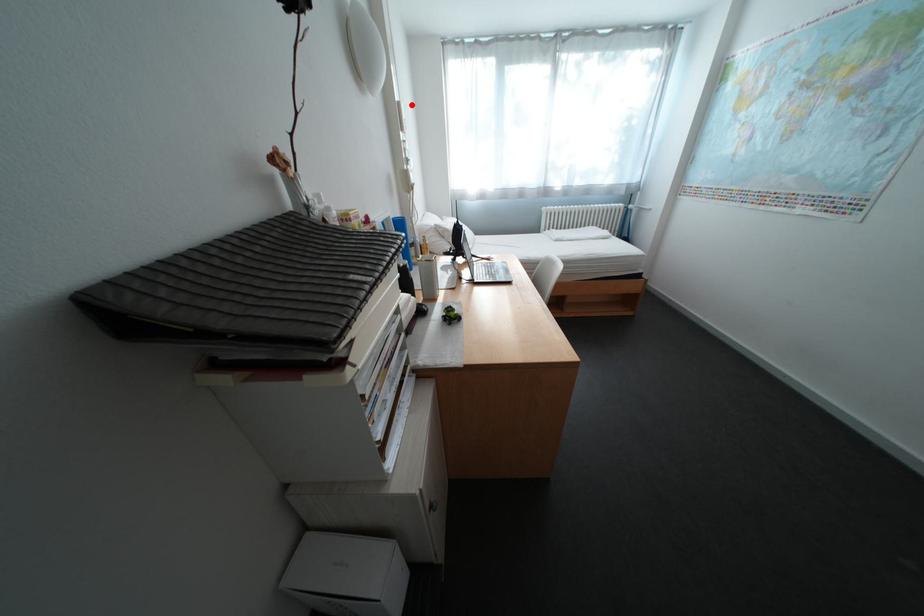
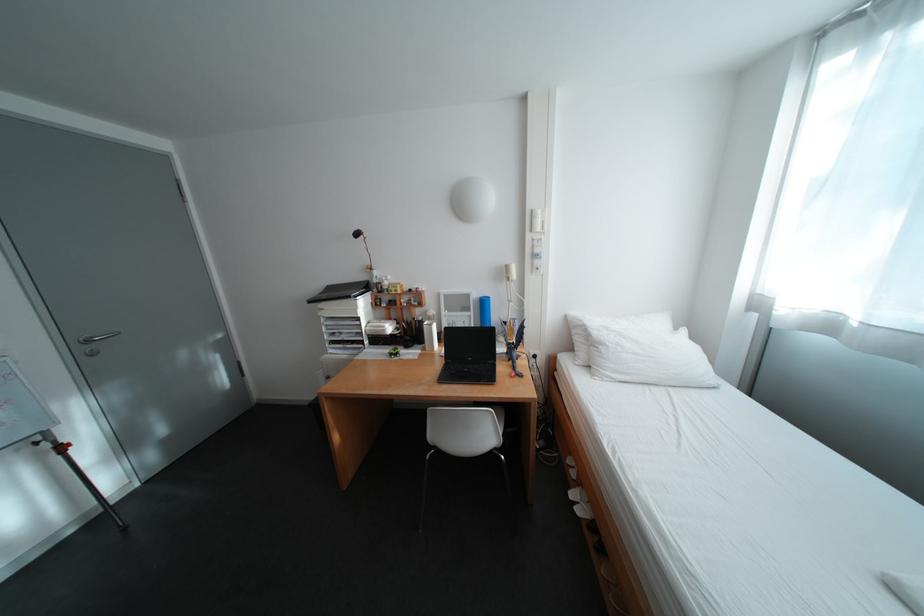
Where in the second image is the point corresponding to the highlighted location from the first image?

(544, 213)